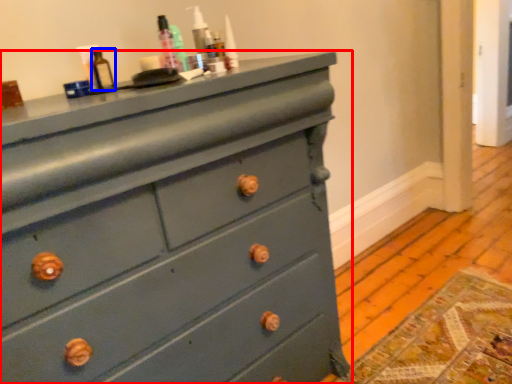
Question: Which object appears farthest to the camera in this image, chest of drawers (highlighted by a red box) or bottle (highlighted by a blue box)?

Choices:
 (A) chest of drawers
 (B) bottle

Answer: (B)